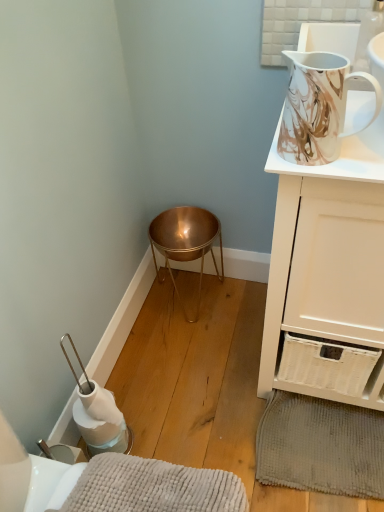
In order to face soft gray plush bath mat at lower left, the first bath mat when ordered from front to back, should I rotate leftwards or rightwards?

Turn left by 4.541 degrees to look at soft gray plush bath mat at lower left, the first bath mat when ordered from front to back.

Describe the element at coordinates (318, 106) in the screenshot. I see `marble-patterned ceramic jug at upper right` at that location.

Where is `gray textured bath mat at lower right, acting as the 1th bath mat starting from the right`? The image size is (384, 512). gray textured bath mat at lower right, acting as the 1th bath mat starting from the right is located at coordinates (321, 446).

The height and width of the screenshot is (512, 384). Describe the element at coordinates (321, 446) in the screenshot. I see `gray textured bath mat at lower right, the 2th bath mat in the front-to-back sequence` at that location.

The width and height of the screenshot is (384, 512). What are the coordinates of `soft gray plush bath mat at lower left, arranged as the second bath mat when viewed from the right` in the screenshot? It's located at (153, 487).

Which is more to the left, white glossy cabinet at upper right or marble-patterned ceramic jug at upper right?

Positioned to the left is marble-patterned ceramic jug at upper right.

Is white glossy cabinet at upper right thinner than marble-patterned ceramic jug at upper right?

Incorrect, the width of white glossy cabinet at upper right is not less than that of marble-patterned ceramic jug at upper right.

Where is `cabinetry located in front of the marble-patterned ceramic jug at upper right`? Image resolution: width=384 pixels, height=512 pixels. cabinetry located in front of the marble-patterned ceramic jug at upper right is located at coordinates (328, 264).

Image resolution: width=384 pixels, height=512 pixels. I want to click on jug that appears in front of the copper metallic bowl at lower center, so click(318, 106).

Does copper metallic bowl at lower center come behind marble-patterned ceramic jug at upper right?

Yes, the depth of copper metallic bowl at lower center is greater than that of marble-patterned ceramic jug at upper right.

Considering the relative sizes of copper metallic bowl at lower center and marble-patterned ceramic jug at upper right in the image provided, is copper metallic bowl at lower center wider than marble-patterned ceramic jug at upper right?

Indeed, copper metallic bowl at lower center has a greater width compared to marble-patterned ceramic jug at upper right.

From a real-world perspective, is copper metallic bowl at lower center located higher than marble-patterned ceramic jug at upper right?

Incorrect, from a real-world perspective, copper metallic bowl at lower center is lower than marble-patterned ceramic jug at upper right.

I want to click on stool that appears behind the white glossy cabinet at upper right, so click(x=185, y=241).

Which is in front, point (347, 214) or point (216, 222)?

The point (347, 214) is closer.

Can you tell me how much white glossy cabinet at upper right and copper metallic bowl at lower center differ in facing direction?

There is a 0.000148-degree angle between the facing directions of white glossy cabinet at upper right and copper metallic bowl at lower center.

From the image's perspective, who appears lower, white glossy cabinet at upper right or copper metallic bowl at lower center?

From the image's view, copper metallic bowl at lower center is below.

This screenshot has width=384, height=512. Find the location of `stool above the gray textured bath mat at lower right, the 2th bath mat in the front-to-back sequence (from the image's perspective)`. stool above the gray textured bath mat at lower right, the 2th bath mat in the front-to-back sequence (from the image's perspective) is located at coordinates (185, 241).

Which object is further away from the camera, copper metallic bowl at lower center or gray textured bath mat at lower right, arranged as the 2th bath mat when viewed from the left?

copper metallic bowl at lower center is behind.

From a real-world perspective, which is physically below, copper metallic bowl at lower center or gray textured bath mat at lower right, acting as the 1th bath mat starting from the right?

gray textured bath mat at lower right, acting as the 1th bath mat starting from the right, from a real-world perspective.

Is gray textured bath mat at lower right, the 2th bath mat in the front-to-back sequence, oriented away from white glossy cabinet at upper right?

That's right, gray textured bath mat at lower right, the 2th bath mat in the front-to-back sequence, is facing away from white glossy cabinet at upper right.

Is gray textured bath mat at lower right, the 2th bath mat in the front-to-back sequence, positioned far away from white glossy cabinet at upper right?

No, gray textured bath mat at lower right, the 2th bath mat in the front-to-back sequence, is not far from white glossy cabinet at upper right.

Does gray textured bath mat at lower right, the 2th bath mat in the front-to-back sequence, have a larger size compared to white glossy cabinet at upper right?

Actually, gray textured bath mat at lower right, the 2th bath mat in the front-to-back sequence, might be smaller than white glossy cabinet at upper right.

Starting from the white glossy cabinet at upper right, which bath mat is the 2nd one to the left? Please provide its 2D coordinates.

[(153, 487)]

What's the angular difference between white glossy cabinet at upper right and soft gray plush bath mat at lower left, the second bath mat positioned from the back,'s facing directions?

90.5 degrees separate the facing orientations of white glossy cabinet at upper right and soft gray plush bath mat at lower left, the second bath mat positioned from the back.

Is white glossy cabinet at upper right wider or thinner than soft gray plush bath mat at lower left, which is the first bath mat in left-to-right order?

In the image, white glossy cabinet at upper right appears to be wider than soft gray plush bath mat at lower left, which is the first bath mat in left-to-right order.

Does white glossy cabinet at upper right have a smaller size compared to soft gray plush bath mat at lower left, the second bath mat positioned from the back?

Actually, white glossy cabinet at upper right might be larger than soft gray plush bath mat at lower left, the second bath mat positioned from the back.

Which is nearer, (324,120) or (201,216)?

Positioned in front is point (324,120).

Is marble-patterned ceramic jug at upper right aimed at copper metallic bowl at lower center?

No, marble-patterned ceramic jug at upper right is not oriented towards copper metallic bowl at lower center.

Locate an element on the screen. stool that appears behind the marble-patterned ceramic jug at upper right is located at coordinates (185, 241).

Is marble-patterned ceramic jug at upper right inside the boundaries of copper metallic bowl at lower center, or outside?

marble-patterned ceramic jug at upper right is not inside copper metallic bowl at lower center, it's outside.

Find the location of `cabinetry in front of the marble-patterned ceramic jug at upper right`. cabinetry in front of the marble-patterned ceramic jug at upper right is located at coordinates (328, 264).

The width and height of the screenshot is (384, 512). I want to click on jug lying on the right of copper metallic bowl at lower center, so 318,106.

Based on their spatial positions, is white glossy cabinet at upper right or soft gray plush bath mat at lower left, which is the first bath mat in left-to-right order, further from marble-patterned ceramic jug at upper right?

soft gray plush bath mat at lower left, which is the first bath mat in left-to-right order.

Considering their positions, is copper metallic bowl at lower center positioned closer to gray textured bath mat at lower right, which appears as the 1th bath mat when viewed from the back, than marble-patterned ceramic jug at upper right?

copper metallic bowl at lower center is closer to gray textured bath mat at lower right, which appears as the 1th bath mat when viewed from the back.

From the image, which object appears to be farther from copper metallic bowl at lower center, marble-patterned ceramic jug at upper right or soft gray plush bath mat at lower left, arranged as the second bath mat when viewed from the right?

soft gray plush bath mat at lower left, arranged as the second bath mat when viewed from the right, is positioned further to the anchor copper metallic bowl at lower center.

Estimate the real-world distances between objects in this image. Which object is closer to white glossy cabinet at upper right, marble-patterned ceramic jug at upper right or gray textured bath mat at lower right, the 2th bath mat in the front-to-back sequence?

marble-patterned ceramic jug at upper right is closer to white glossy cabinet at upper right.

When comparing their distances from white glossy cabinet at upper right, does gray textured bath mat at lower right, which appears as the 1th bath mat when viewed from the back, or soft gray plush bath mat at lower left, which is the first bath mat in left-to-right order, seem further?

soft gray plush bath mat at lower left, which is the first bath mat in left-to-right order, is positioned further to the anchor white glossy cabinet at upper right.

Based on their spatial positions, is copper metallic bowl at lower center or gray textured bath mat at lower right, which appears as the 1th bath mat when viewed from the back, further from soft gray plush bath mat at lower left, which is the first bath mat in left-to-right order?

copper metallic bowl at lower center is further to soft gray plush bath mat at lower left, which is the first bath mat in left-to-right order.

Based on their spatial positions, is white glossy cabinet at upper right or marble-patterned ceramic jug at upper right further from copper metallic bowl at lower center?

marble-patterned ceramic jug at upper right is further to copper metallic bowl at lower center.

Which object lies further to the anchor point gray textured bath mat at lower right, the 2th bath mat in the front-to-back sequence, marble-patterned ceramic jug at upper right or white glossy cabinet at upper right?

marble-patterned ceramic jug at upper right.

The width and height of the screenshot is (384, 512). I want to click on cabinetry between marble-patterned ceramic jug at upper right and soft gray plush bath mat at lower left, which is the first bath mat in left-to-right order, in the up-down direction, so click(328, 264).

You are a GUI agent. You are given a task and a screenshot of the screen. Output one action in this format:
    pyautogui.click(x=<x>, y=<y>)
    Task: Click on the cabinetry between marble-patterned ceramic jug at upper right and gray textured bath mat at lower right, which appears as the 1th bath mat when viewed from the back, vertically
    
    Given the screenshot: What is the action you would take?
    328,264

You are a GUI agent. You are given a task and a screenshot of the screen. Output one action in this format:
    pyautogui.click(x=<x>, y=<y>)
    Task: Click on the bath mat located between soft gray plush bath mat at lower left, the first bath mat when ordered from front to back, and copper metallic bowl at lower center in the depth direction
    This screenshot has height=512, width=384.
    Given the screenshot: What is the action you would take?
    pyautogui.click(x=321, y=446)

The image size is (384, 512). I want to click on jug between soft gray plush bath mat at lower left, arranged as the second bath mat when viewed from the right, and copper metallic bowl at lower center from front to back, so [x=318, y=106].